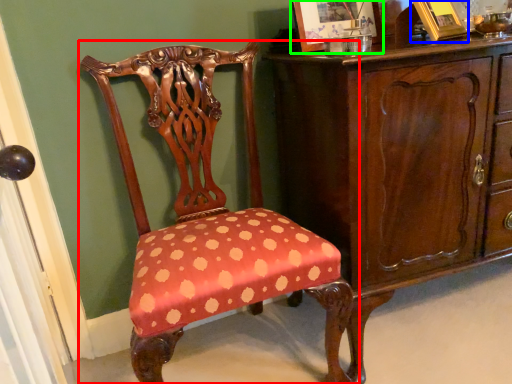
Question: Considering the real-world distances, which object is farthest from chair (highlighted by a red box)? picture frame (highlighted by a blue box) or picture frame (highlighted by a green box)?

Choices:
 (A) picture frame
 (B) picture frame

Answer: (A)